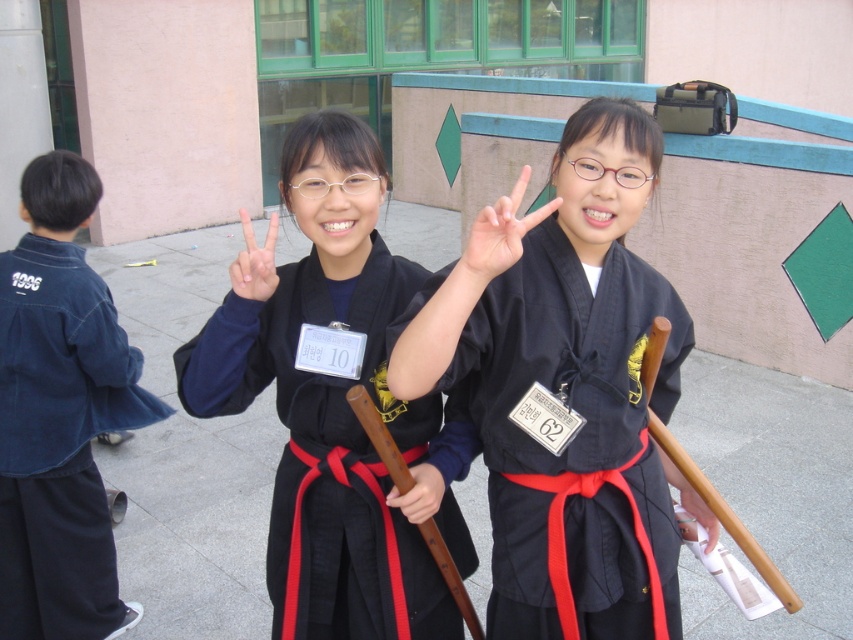
Does point (27, 609) come farther from viewer compared to point (683, 536)?

Yes, it is behind point (683, 536).

Who is higher up, denim jacket at left or white matte hand at center?

denim jacket at left is above.

At what (x,y) coordinates should I click in order to perform the action: click on denim jacket at left. Please return your answer as a coordinate pair (x, y). Looking at the image, I should click on (61, 416).

Where is `denim jacket at left`? This screenshot has width=853, height=640. denim jacket at left is located at coordinates (61, 416).

Can you confirm if black cotton karate uniform at center is positioned to the right of white matte hand at center?

Incorrect, black cotton karate uniform at center is not on the right side of white matte hand at center.

Is black cotton karate uniform at center smaller than white matte hand at center?

No, black cotton karate uniform at center is not smaller than white matte hand at center.

Measure the distance between point (x=305, y=566) and camera.

The distance of point (x=305, y=566) from camera is 5.90 feet.

Locate an element on the screen. black cotton karate uniform at center is located at coordinates (338, 456).

I want to click on matte black hand at center, so click(483, 188).

Is matte black hand at center to the left of wooden stick at center from the viewer's perspective?

In fact, matte black hand at center is to the right of wooden stick at center.

Is point (483, 205) in front of point (426, 470)?

No.

Where is `matte black hand at center`? This screenshot has width=853, height=640. matte black hand at center is located at coordinates (483, 188).